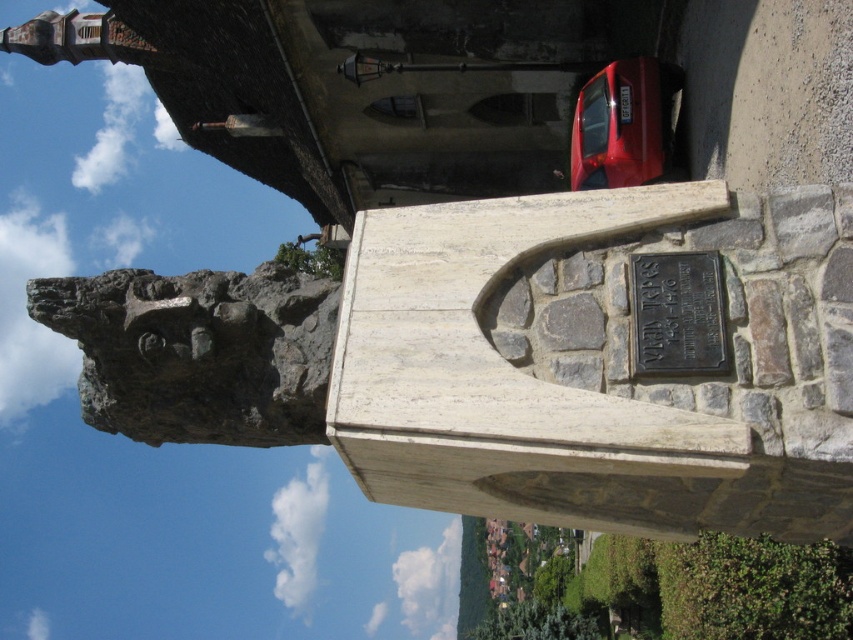
Question: Which object is closer to the camera taking this photo?

Choices:
 (A) rough gray rock at upper left
 (B) shiny red car at right
 (C) black metal plaque at center

Answer: (C)

Question: Is shiny red car at right bigger than black metal plaque at center?

Choices:
 (A) yes
 (B) no

Answer: (A)

Question: Among these objects, which one is nearest to the camera?

Choices:
 (A) black metal plaque at center
 (B) rough gray rock at upper left

Answer: (A)

Question: Based on their relative distances, which object is farther from the rough gray rock at upper left?

Choices:
 (A) shiny red car at right
 (B) black metal plaque at center

Answer: (A)

Question: From the image, what is the correct spatial relationship of rough gray rock at upper left in relation to shiny red car at right?

Choices:
 (A) right
 (B) left

Answer: (B)

Question: Does rough gray rock at upper left have a greater width compared to black metal plaque at center?

Choices:
 (A) no
 (B) yes

Answer: (B)